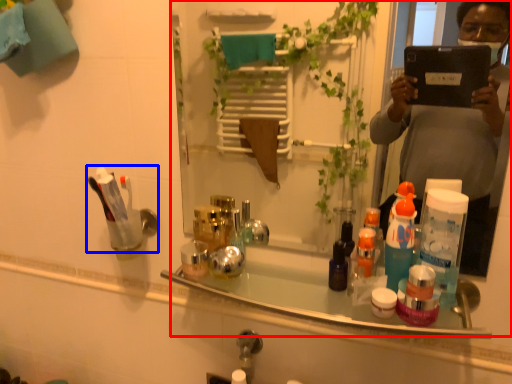
Question: Which object appears closest to the camera in this image, mirror (highlighted by a red box) or toiletry (highlighted by a blue box)?

Choices:
 (A) mirror
 (B) toiletry

Answer: (A)